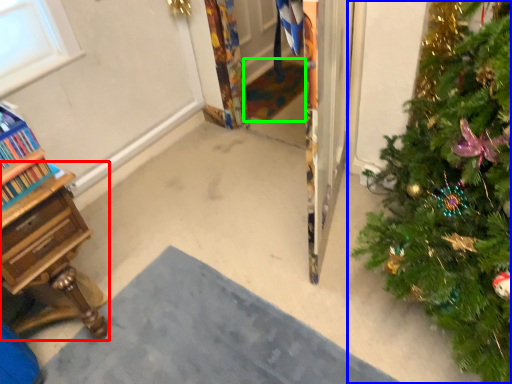
Question: Based on their relative distances, which object is nearer to desk (highlighted by a red box)? Choose from christmas tree (highlighted by a blue box) and doormat (highlighted by a green box).

Choices:
 (A) christmas tree
 (B) doormat

Answer: (A)